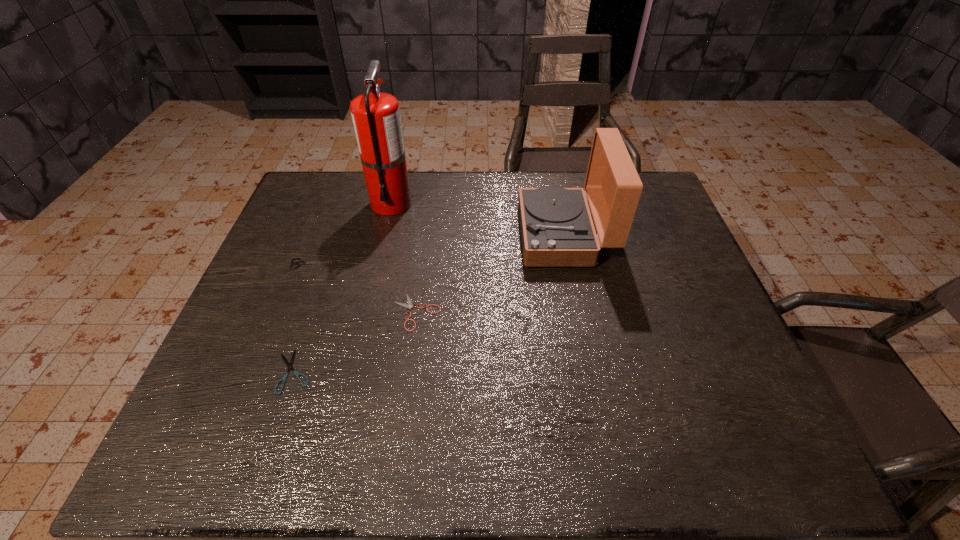
The image size is (960, 540). I want to click on vacant position located 0.060m on the face of the phonograph record, so click(499, 235).

This screenshot has width=960, height=540. I want to click on vacant space situated on the face of the phonograph record, so click(461, 235).

This screenshot has height=540, width=960. What are the coordinates of `free space located on the front of the farthest shears` in the screenshot? It's located at (283, 335).

I want to click on vacant space located 0.170m on the right of the second farthest shears, so click(511, 312).

Find the location of a particular element. The height and width of the screenshot is (540, 960). vacant space located 0.050m on the back of the nearest object is located at coordinates (307, 332).

I want to click on fire extinguisher located in the far edge section of the desktop, so click(376, 118).

Locate an element on the screen. The image size is (960, 540). phonograph record present at the far edge is located at coordinates (557, 230).

In order to click on vacant space at the far edge in this screenshot , I will do `click(576, 186)`.

Find the location of `free location at the near edge of the desktop`. free location at the near edge of the desktop is located at coordinates (638, 445).

The image size is (960, 540). In the image, there is a desktop. What are the coordinates of `free space at the left edge` in the screenshot? It's located at (275, 320).